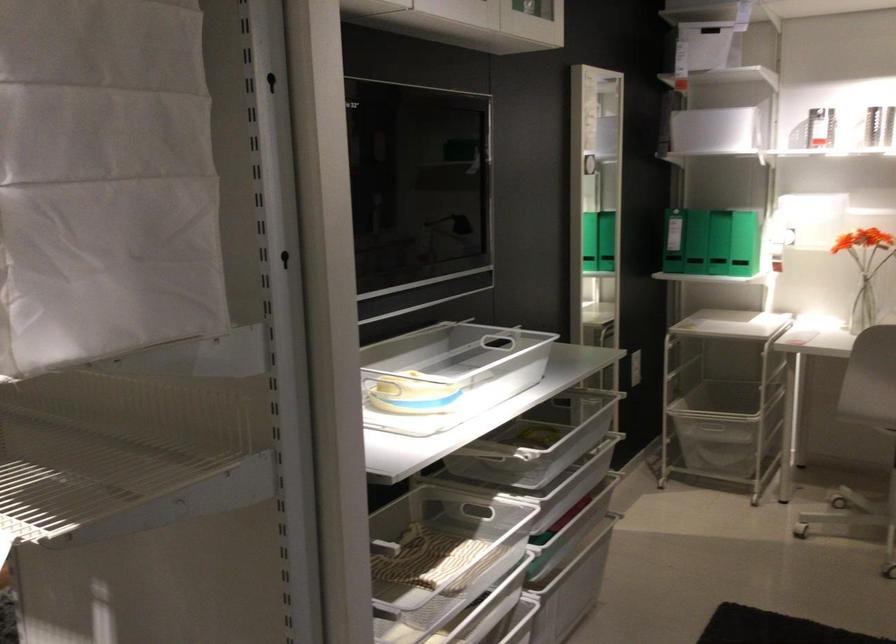
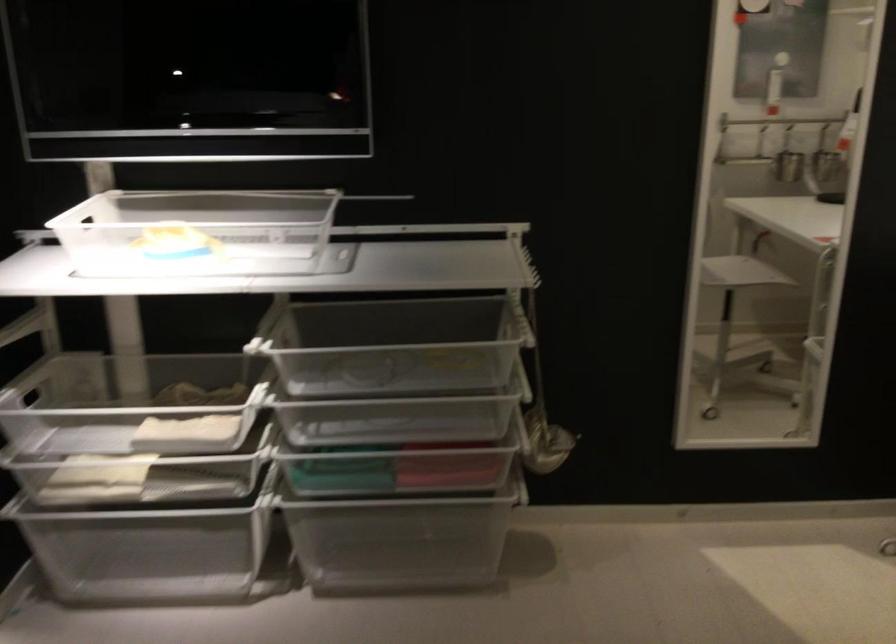
Locate, in the second image, the point that corresponds to (411,353) in the first image.

(197, 232)